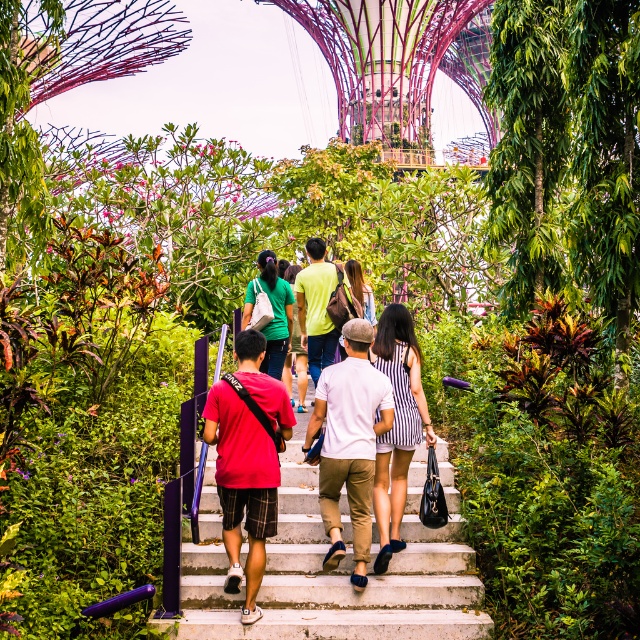
You are standing at the base of the stairs in the Gardens by the Bay, looking up towards the Supertree Grove. There are two points marked on the stairs you are about to climb. One is at coordinate point(396, 397) and the other at point(273, 323). Which point is closer to you as you start climbing?

The point at coordinate(396, 397) is closer to the viewer than point(273, 323), so that point is closer to you as you start climbing.